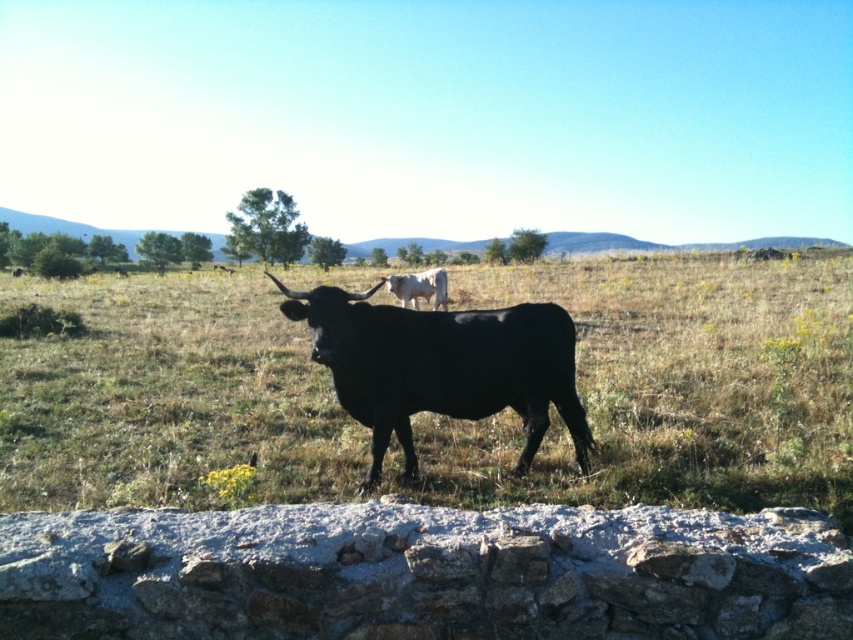
Can you confirm if green grass at center is thinner than white smooth cow at center?

Incorrect, green grass at center's width is not less than white smooth cow at center's.

From the picture: Is green grass at center shorter than white smooth cow at center?

No.

What do you see at coordinates (670, 388) in the screenshot? I see `green grass at center` at bounding box center [670, 388].

Locate an element on the screen. green grass at center is located at coordinates (670, 388).

Can you confirm if black glossy bull at center is smaller than white smooth cow at center?

Yes, black glossy bull at center is smaller than white smooth cow at center.

Looking at this image, which of these two, black glossy bull at center or white smooth cow at center, stands taller?

With more height is black glossy bull at center.

The height and width of the screenshot is (640, 853). In order to click on black glossy bull at center in this screenshot , I will do `click(442, 365)`.

Which is behind, point (624, 282) or point (517, 344)?

Positioned behind is point (624, 282).

Does green grass at center appear on the right side of black glossy bull at center?

Yes, green grass at center is to the right of black glossy bull at center.

Is point (711, 285) farther from camera compared to point (469, 362)?

Yes, it is behind point (469, 362).

Where is `green grass at center`? green grass at center is located at coordinates (670, 388).